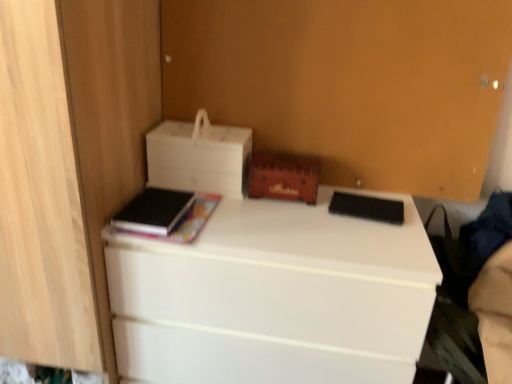
Question: Is white matte desk at center surrounding black matte paperback book at center, the 2th paperback book when ordered from left to right?

Choices:
 (A) yes
 (B) no

Answer: (B)

Question: Is white matte desk at center thinner than black matte paperback book at center, the first paperback book in the right-to-left sequence?

Choices:
 (A) yes
 (B) no

Answer: (B)

Question: Is white matte desk at center in contact with black matte paperback book at center, the 2th paperback book when ordered from left to right?

Choices:
 (A) no
 (B) yes

Answer: (A)

Question: From the image's perspective, does white matte desk at center appear lower than black matte paperback book at center, the first paperback book in the right-to-left sequence?

Choices:
 (A) no
 (B) yes

Answer: (B)

Question: From the image's perspective, is white matte desk at center located above black matte paperback book at center, the 2th paperback book when ordered from left to right?

Choices:
 (A) yes
 (B) no

Answer: (B)

Question: Can you confirm if white matte desk at center is smaller than black matte paperback book at center, the 2th paperback book when ordered from left to right?

Choices:
 (A) no
 (B) yes

Answer: (A)

Question: From a real-world perspective, is white matte desk at center on top of black matte book at left, acting as the first paperback book starting from the left?

Choices:
 (A) yes
 (B) no

Answer: (B)

Question: From the image's perspective, is white matte desk at center under black matte book at left, acting as the first paperback book starting from the left?

Choices:
 (A) yes
 (B) no

Answer: (A)

Question: Is there a large distance between white matte desk at center and black matte book at left, acting as the first paperback book starting from the left?

Choices:
 (A) no
 (B) yes

Answer: (A)

Question: Is white matte desk at center positioned beyond the bounds of black matte book at left, the 2th paperback book positioned from the right?

Choices:
 (A) yes
 (B) no

Answer: (A)

Question: Does white matte desk at center have a smaller size compared to black matte book at left, the 2th paperback book positioned from the right?

Choices:
 (A) no
 (B) yes

Answer: (A)

Question: Is black matte book at left, the 2th paperback book positioned from the right, completely or partially inside white matte desk at center?

Choices:
 (A) no
 (B) yes

Answer: (A)

Question: From the image's perspective, is white matte printer at upper left above black matte book at left, the 2th paperback book positioned from the right?

Choices:
 (A) no
 (B) yes

Answer: (B)